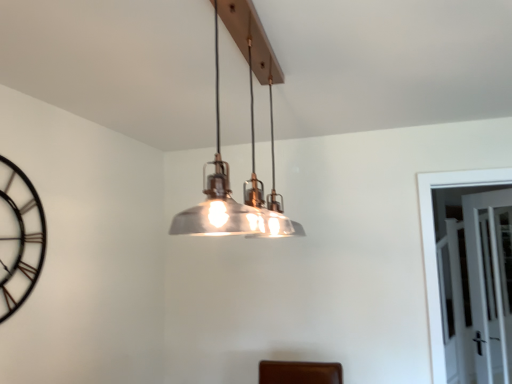
Question: Is clear glass door at right taller or shorter than metallic/textured pendant light at center?

Choices:
 (A) tall
 (B) short

Answer: (A)

Question: Based on their sizes in the image, would you say clear glass door at right is bigger or smaller than metallic/textured pendant light at center?

Choices:
 (A) big
 (B) small

Answer: (B)

Question: Which object is the closest to the black metal clock at left?

Choices:
 (A) clear glass door at right
 (B) metallic/textured pendant light at center

Answer: (B)

Question: Which object is the closest to the metallic/textured pendant light at center?

Choices:
 (A) clear glass door at right
 (B) black metal clock at left

Answer: (B)